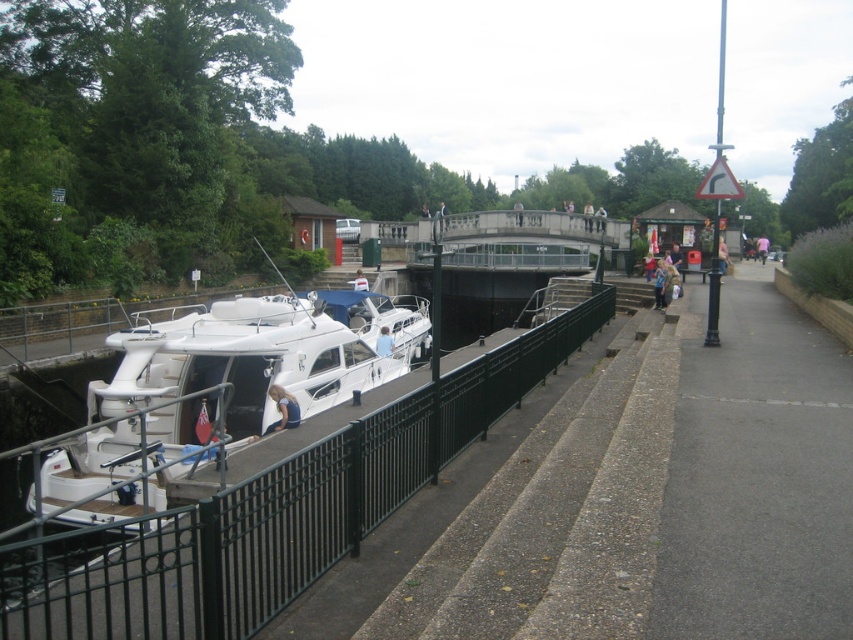
Which of these two, blue fabric shirt at lower left or blue denim jacket at lower right, stands taller?

blue denim jacket at lower right is taller.

Is blue fabric shirt at lower left smaller than blue denim jacket at lower right?

Yes.

Is point (276, 392) behind point (654, 298)?

No, it is not.

Where is `blue fabric shirt at lower left`? The height and width of the screenshot is (640, 853). blue fabric shirt at lower left is located at coordinates (283, 408).

Does white glossy boat at left have a greater width compared to pink fabric person at center-right?

No.

Can you confirm if white glossy boat at left is positioned below pink fabric person at center-right?

Yes, white glossy boat at left is below pink fabric person at center-right.

Identify the location of white glossy boat at left. The height and width of the screenshot is (640, 853). (200, 400).

Describe the element at coordinates (271, 513) in the screenshot. I see `black metal fence at lower left` at that location.

Measure the distance between black metal fence at lower left and camera.

3.48 meters

Where is `black metal fence at lower left`? The height and width of the screenshot is (640, 853). black metal fence at lower left is located at coordinates (271, 513).